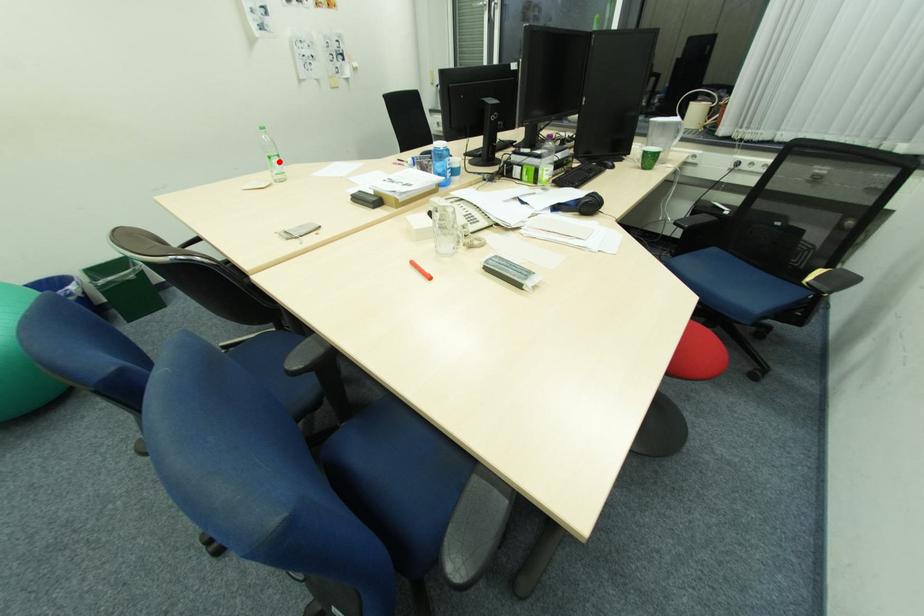
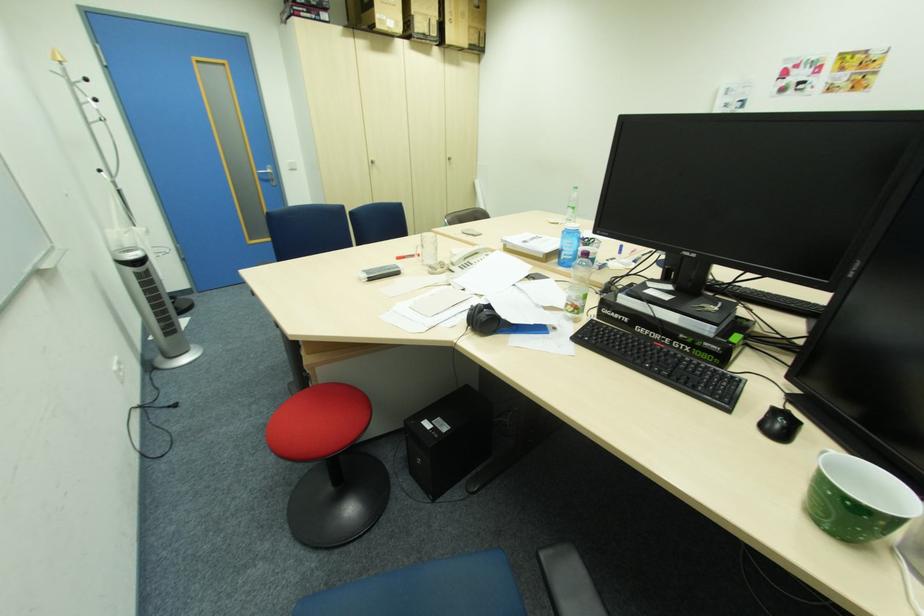
Locate, in the second image, the point that corresponds to the highlighted location in the first image.

(574, 209)